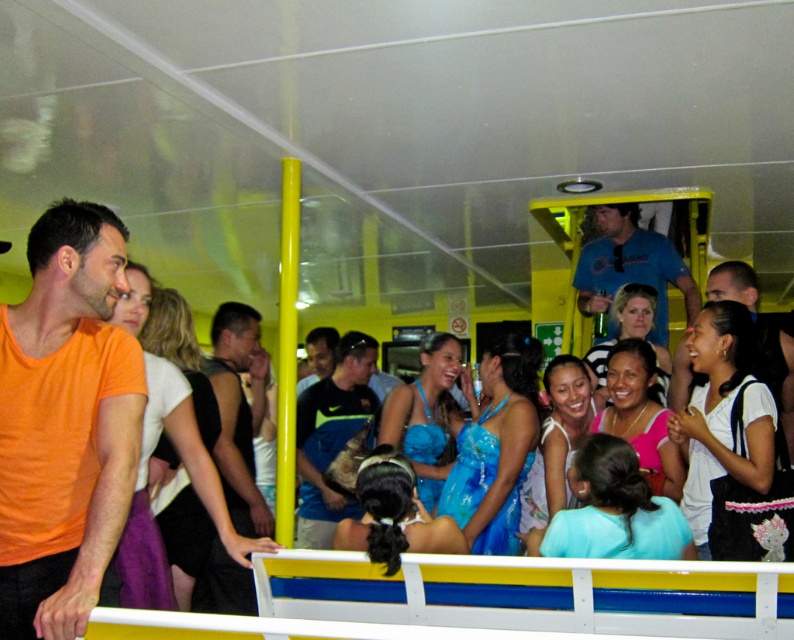
Which is below, orange matte t-shirt at center or blue t-shirt at upper right?

Positioned lower is orange matte t-shirt at center.

Does point (122, 456) come closer to viewer compared to point (661, 301)?

That is True.

Locate an element on the screen. The height and width of the screenshot is (640, 794). orange matte t-shirt at center is located at coordinates (64, 422).

Is point (33, 454) more distant than point (299, 397)?

No, it is not.

Is orange matte t-shirt at center wider than blue fabric shirt at center?

Incorrect, orange matte t-shirt at center's width does not surpass blue fabric shirt at center's.

The height and width of the screenshot is (640, 794). In order to click on orange matte t-shirt at center in this screenshot , I will do `click(64, 422)`.

Does blue fabric shirt at center have a lesser height compared to blue t-shirt at upper right?

Incorrect, blue fabric shirt at center's height does not fall short of blue t-shirt at upper right's.

The image size is (794, 640). What do you see at coordinates (330, 436) in the screenshot? I see `blue fabric shirt at center` at bounding box center [330, 436].

What do you see at coordinates (330, 436) in the screenshot?
I see `blue fabric shirt at center` at bounding box center [330, 436].

The width and height of the screenshot is (794, 640). In order to click on blue fabric shirt at center in this screenshot , I will do `click(330, 436)`.